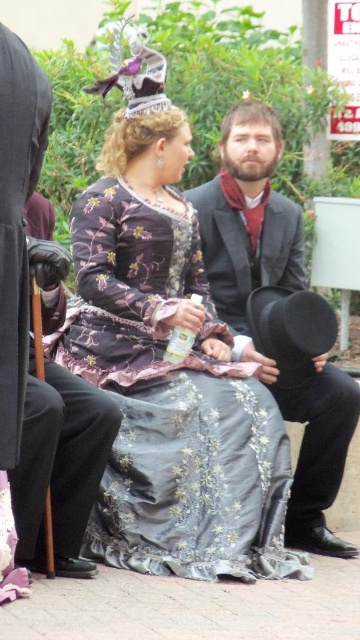
You are a photographer at a historical event. You need to position two subjects in a photo so that their heights are accurately represented. The subjects are wearing the silky purple dress at center and the matte black suit at center. According to the scene, which subject should you place higher in the frame to maintain the correct height relationship?

The silky purple dress at center has a greater height compared to the matte black suit at center, so you should position the silky purple dress at center higher in the frame to maintain the correct height relationship.

You are planning to seat two people in a narrow hallway. The silky purple dress at center and the matte black suit at center are both present. Which clothing item requires more space to accommodate its width?

The silky purple dress at center might be wider than matte black suit at center, so it requires more space to accommodate its width.

You are standing in a historical museum and see the silky purple dress at center displayed in a glass case. The museum requires that visitors maintain a minimum distance of 8 meters from all exhibits for preservation purposes. Are you currently violating the museum rules?

The silky purple dress at center and viewer are 7.96 meters apart. Since the required minimum distance is 8 meters, you are currently violating the museum rules by being too close to the exhibit.